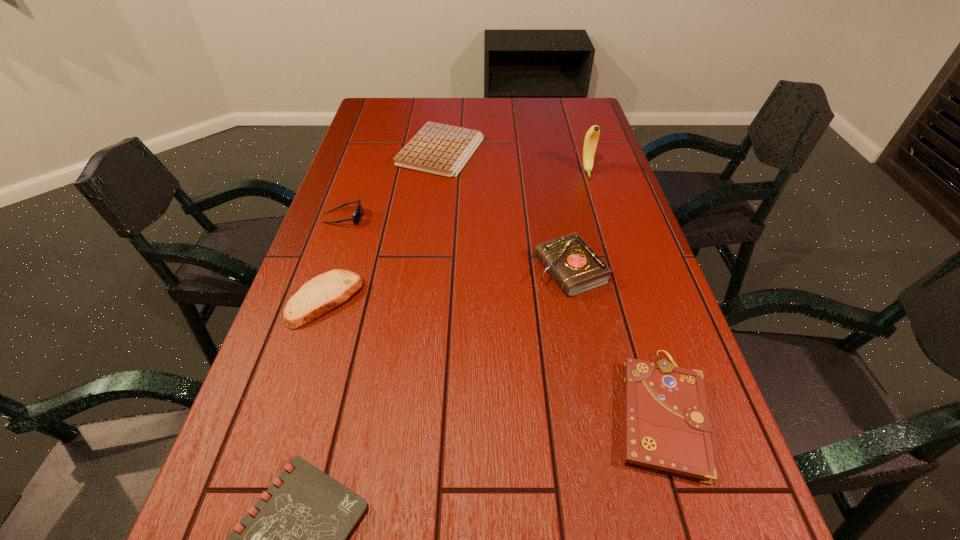
Find the location of a particular element. This screenshot has height=540, width=960. free point between the rightmost notebook and the second tallest notebook is located at coordinates (551, 282).

Identify the location of object identified as the closest to the tallest object. This screenshot has width=960, height=540. (576, 268).

Locate which object is the fourth closest to the tallest notebook. Please provide its 2D coordinates. Your answer should be formatted as a tuple, i.e. [(x, y)], where the tuple contains the x and y coordinates of a point satisfying the conditions above.

[(591, 139)]

Identify the location of notebook that stands as the second closest to the shortest object. (440, 149).

This screenshot has height=540, width=960. I want to click on notebook that stands as the second closest to the farthest notebook, so click(x=299, y=539).

The width and height of the screenshot is (960, 540). What are the coordinates of `free space that satisfies the following two spatial constraints: 1. on the front side of the rightmost notebook; 2. on the left side of the sixth shortest object` in the screenshot? It's located at coord(599,413).

Find the location of a particular element. The height and width of the screenshot is (540, 960). vacant area that satisfies the following two spatial constraints: 1. on the front-facing side of the sixth shortest object; 2. on the right side of the fifth shortest object is located at coordinates pyautogui.click(x=325, y=270).

Find the location of a particular element. free spot that satisfies the following two spatial constraints: 1. on the front-facing side of the third farthest object; 2. on the right side of the second tallest object is located at coordinates (325, 270).

What are the coordinates of `vacant space that satisfies the following two spatial constraints: 1. on the front-facing side of the diary; 2. on the right side of the sunglasses` in the screenshot? It's located at pos(325,270).

Where is `blank area in the image that satisfies the following two spatial constraints: 1. from the stem of the tallest object; 2. on the front-facing side of the sunglasses`? blank area in the image that satisfies the following two spatial constraints: 1. from the stem of the tallest object; 2. on the front-facing side of the sunglasses is located at coordinates (601, 218).